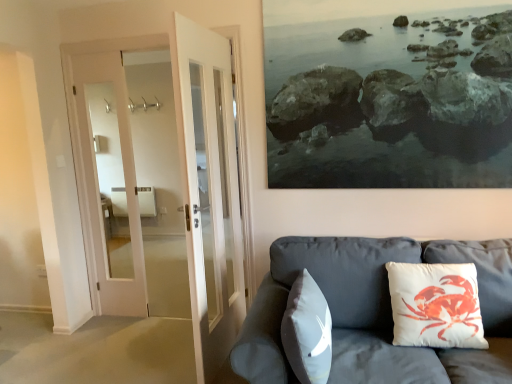
Question: Looking at their shapes, would you say white matte pillow at center, the 1th pillow when ordered from left to right, is wider or thinner than matte gray couch at lower right?

Choices:
 (A) thin
 (B) wide

Answer: (A)

Question: Would you say white matte pillow at center, acting as the second pillow starting from the right, is inside or outside matte gray couch at lower right?

Choices:
 (A) outside
 (B) inside

Answer: (B)

Question: Which object is positioned farthest from the white matte pillow at center, the 1th pillow when ordered from left to right?

Choices:
 (A) matte gray couch at lower right
 (B) white cotton cushion with crab print at right, the 1th pillow viewed from the right

Answer: (B)

Question: Which object is the farthest from the matte gray couch at lower right?

Choices:
 (A) white cotton cushion with crab print at right, which is counted as the 2th pillow, starting from the left
 (B) white matte pillow at center, acting as the second pillow starting from the right

Answer: (B)